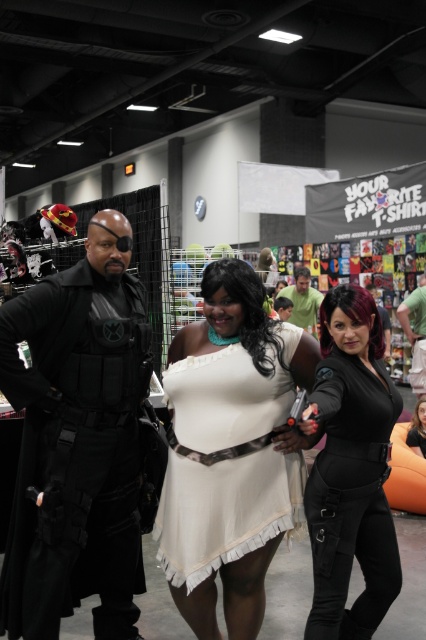
Question: Estimate the real-world distances between objects in this image. Which object is closer to the white satin dress at center?

Choices:
 (A) black leather vest at center
 (B) matte black bodysuit at center
 (C) black leather jacket at center

Answer: (B)

Question: Considering the relative positions of white satin dress at center and matte black dress at center in the image provided, where is white satin dress at center located with respect to matte black dress at center?

Choices:
 (A) right
 (B) left

Answer: (B)

Question: Can you confirm if matte black bodysuit at center is thinner than green fabric shirt at center?

Choices:
 (A) no
 (B) yes

Answer: (A)

Question: Does black matte vest at center have a greater width compared to green fabric shirt at center?

Choices:
 (A) yes
 (B) no

Answer: (A)

Question: Which point is closer to the camera?

Choices:
 (A) black leather jacket at center
 (B) matte black dress at center

Answer: (B)

Question: Considering the real-world distances, which object is closest to the matte black dress at center?

Choices:
 (A) matte black bodysuit at center
 (B) black leather jacket at center
 (C) white satin dress at center

Answer: (B)